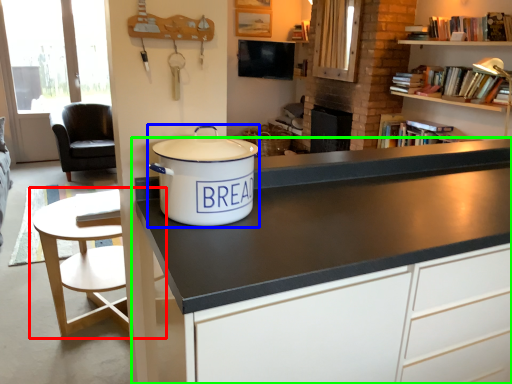
Question: Which object is the closest to the table (highlighted by a red box)? Choose among these: cooker (highlighted by a blue box) or cabinetry (highlighted by a green box).

Choices:
 (A) cooker
 (B) cabinetry

Answer: (A)